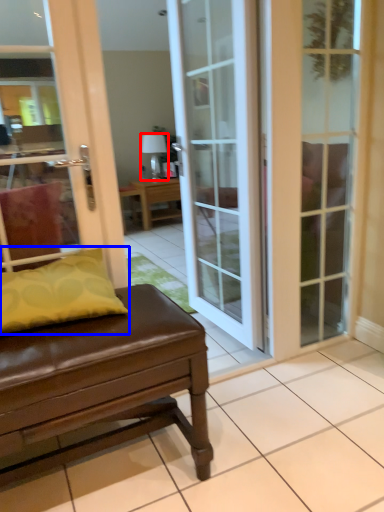
Question: Which object is further to the camera taking this photo, lamp (highlighted by a red box) or pillow (highlighted by a blue box)?

Choices:
 (A) lamp
 (B) pillow

Answer: (A)